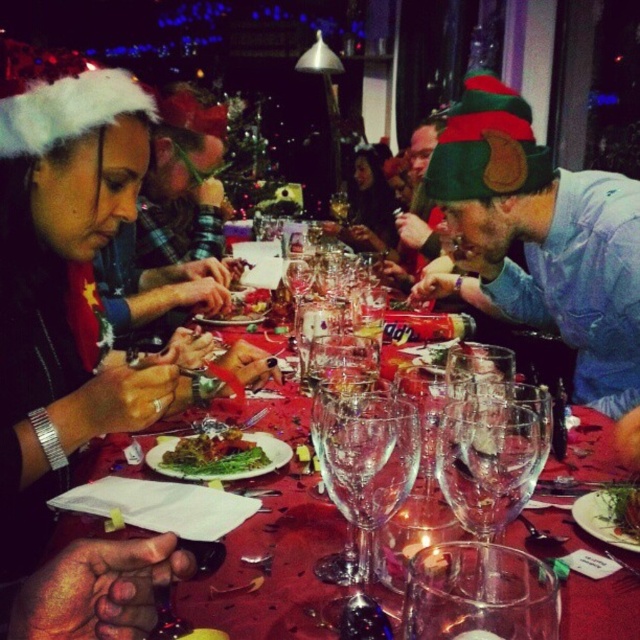
Question: Does matte black santa hat at left appear over green leafy vegetable at center?

Choices:
 (A) no
 (B) yes

Answer: (B)

Question: Which point appears closest to the camera in this image?

Choices:
 (A) (230, 307)
 (B) (344, 492)

Answer: (B)

Question: Where is transparent glass wine glass at center located in relation to green leafymaterial/texturevegetable at center in the image?

Choices:
 (A) above
 (B) below

Answer: (A)

Question: Which of the following is the farthest from the observer?

Choices:
 (A) transparent glass wine glass at center
 (B) transparent glassware at center
 (C) green felt hat at upper right

Answer: (C)

Question: Which object is the farthest from the matte black santa hat at left?

Choices:
 (A) transparent glass wine glass at center
 (B) transparent glassware at center
 (C) green leafy vegetable at center

Answer: (A)

Question: Does transparent glass wine glass at center appear on the left side of green leafymaterial/texturevegetable at center?

Choices:
 (A) yes
 (B) no

Answer: (B)